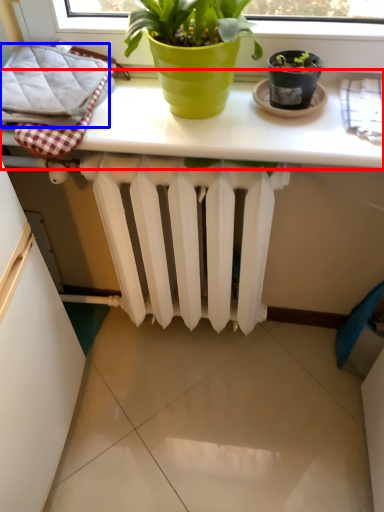
Question: Which of the following is the closest to the observer, table (highlighted by a red box) or bath towel (highlighted by a blue box)?

Choices:
 (A) table
 (B) bath towel

Answer: (A)